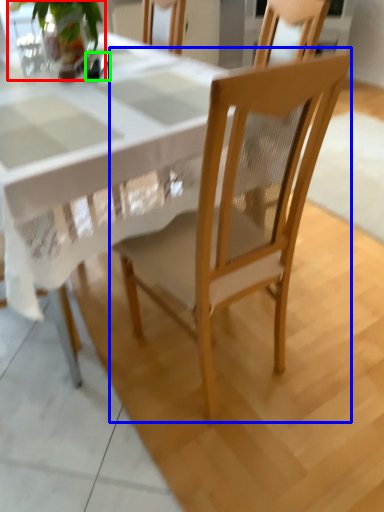
Question: Considering the real-world distances, which object is closest to houseplant (highlighted by a red box)? chair (highlighted by a blue box) or tableware (highlighted by a green box).

Choices:
 (A) chair
 (B) tableware

Answer: (B)